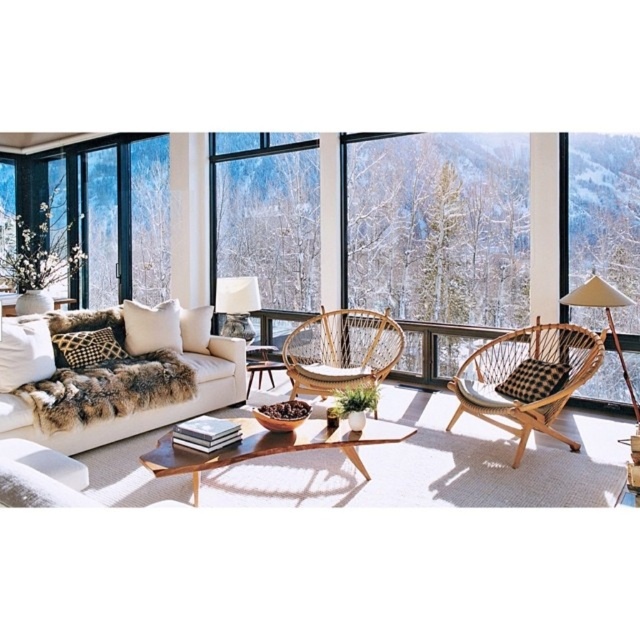
Question: Considering the relative positions of snowy forest at center and woven wood armchair at right in the image provided, where is snowy forest at center located with respect to woven wood armchair at right?

Choices:
 (A) right
 (B) left

Answer: (B)

Question: Considering the real-world distances, which object is farthest from the white fabric lampshade at center?

Choices:
 (A) clear glass window at upper left
 (B) woven rattan chair at center
 (C) light brown wood coffee table at center
 (D) woven wood armchair at right

Answer: (D)

Question: Is snowy forest at center positioned at the back of light brown wood coffee table at center?

Choices:
 (A) yes
 (B) no

Answer: (A)

Question: Which point is closer to the camera taking this photo?

Choices:
 (A) (538, 352)
 (B) (348, 448)

Answer: (B)

Question: Does clear glass window at center appear under woven wood armchair at right?

Choices:
 (A) yes
 (B) no

Answer: (B)

Question: Based on their relative distances, which object is nearer to the woven wood armchair at right?

Choices:
 (A) woven rattan chair at center
 (B) clear glass window at upper left
 (C) light brown wood coffee table at center

Answer: (A)